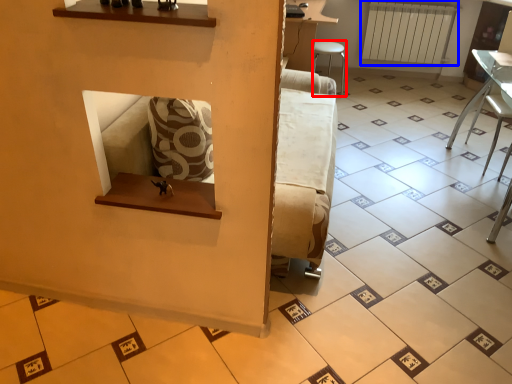
Question: Which point is closer to the camera, furniture (highlighted by a red box) or radiator (highlighted by a blue box)?

Choices:
 (A) furniture
 (B) radiator

Answer: (A)